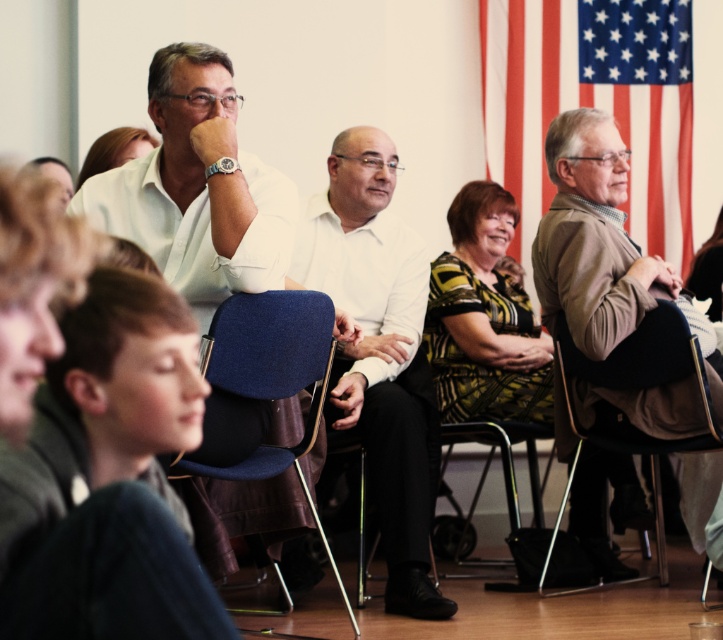
You are organizing a photo shoot and need to ensure that the white smooth shirt at center and the printed fabric dress at center are visible in the frame. Given their sizes, which one might require more space to be fully captured in the photo?

The white smooth shirt at center has a larger size compared to the printed fabric dress at center, so it would require more space to be fully captured in the photo.

You are organizing a photo shoot and need to ensure that the blue fabric chair at center and the matte white shirt at upper center are visible in the frame. Based on their sizes, which object is more likely to be fully visible without any part being cut off?

The blue fabric chair at center is wider than the matte white shirt at upper center, so it is more likely to be fully visible if positioned correctly within the frame.

You are sitting in the front row of the scene and want to hand a note to the person wearing the matte white shirt at upper center. Considering the blue fabric chair at center is in your way, can you reach them without moving the chair?

The blue fabric chair at center is closer to the viewer than the matte white shirt at upper center, so the chair is blocking the path. You would need to move the blue fabric chair at center to reach the person wearing the matte white shirt at upper center.